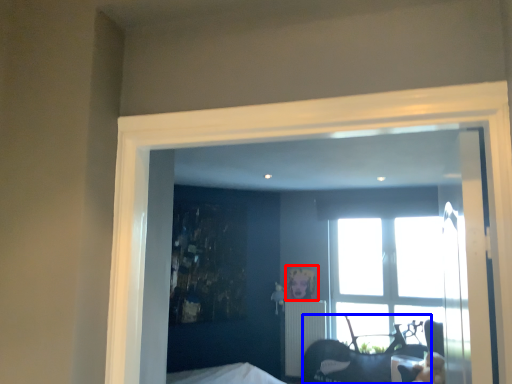
Question: Among these objects, which one is nearest to the camera, picture frame (highlighted by a red box) or furniture (highlighted by a blue box)?

Choices:
 (A) picture frame
 (B) furniture

Answer: (B)